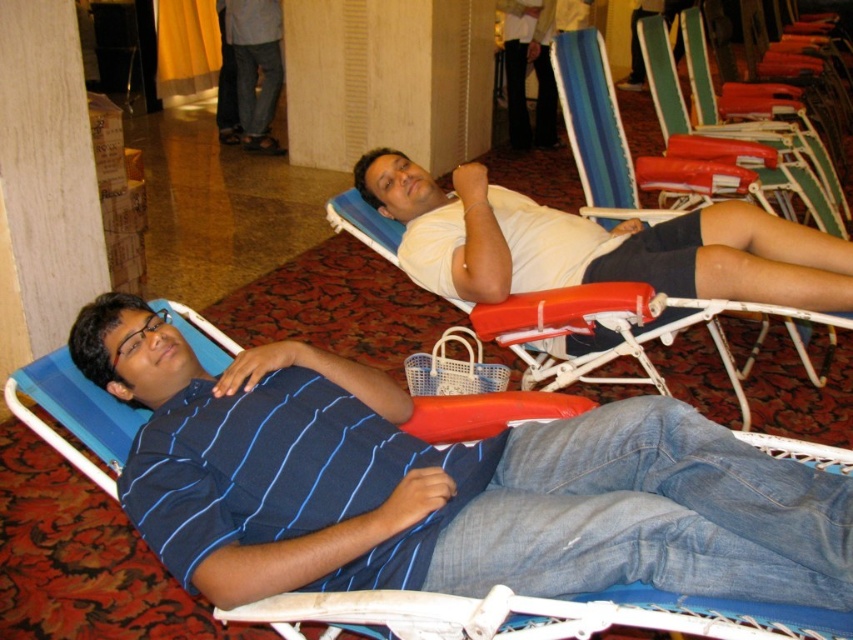
Consider the image. You are designing a layout for a small waiting area and need to place a new sofa. You have a white matte shirt at upper center and an orange plastic beach chair at center in the space. Which object takes up more space in the area?

The orange plastic beach chair at center takes up more space in the area because it is larger than the white matte shirt at upper center.

You are standing in the hallway depicted in the scene. There is an orange plastic beach chair at center. Where would you look to find it?

The orange plastic beach chair at center is located at the 2D coordinates point (631, 337).

Based on the photo, you are designing a new clothing line and want to ensure that the shirts are sized appropriately. You have two shirts in the image, the blue striped shirt at left and the white matte shirt at upper center. Which shirt requires more fabric to produce?

The blue striped shirt at left requires more fabric to produce because its width is larger than the white matte shirt at upper center.